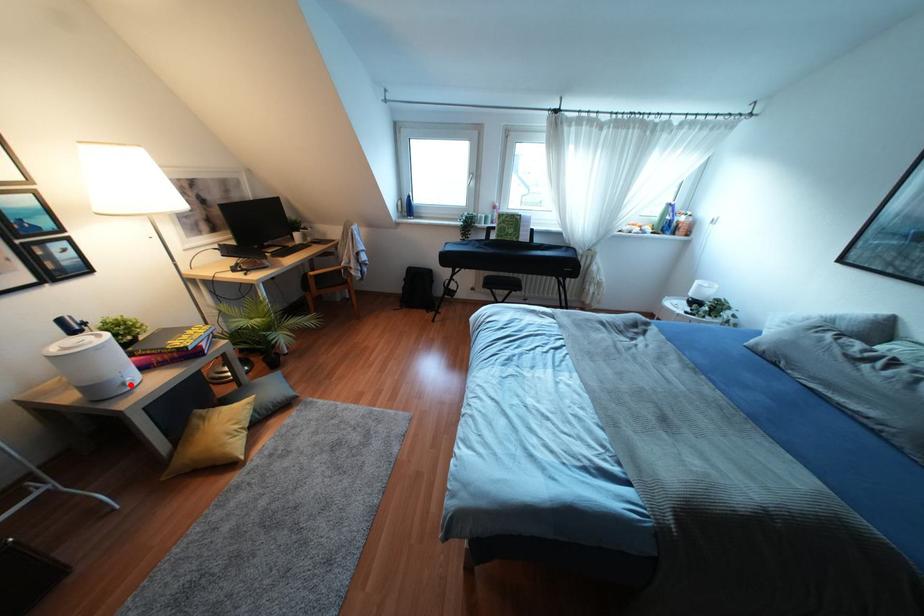
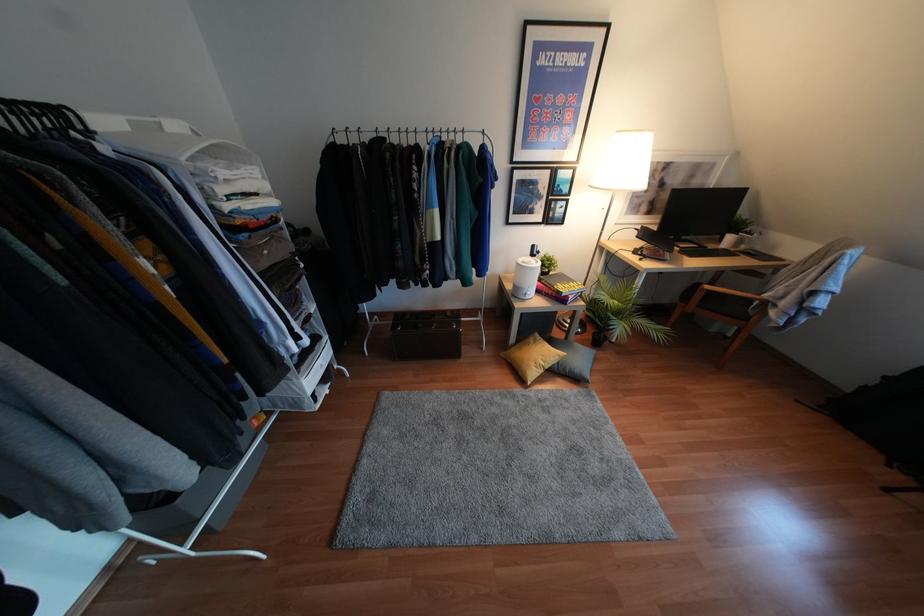
In the second image, find the point that corresponds to the highlighted location in the first image.

(526, 297)